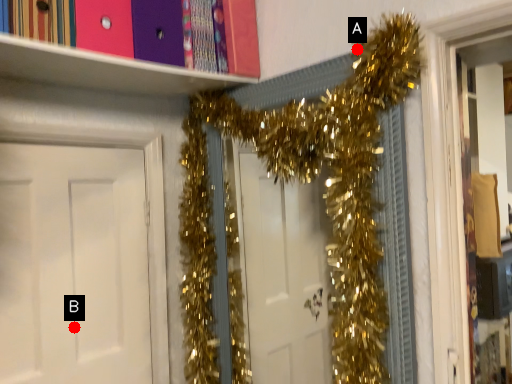
Question: Two points are circled on the image, labeled by A and B beside each circle. Which point is farther to the camera?

Choices:
 (A) A is further
 (B) B is further

Answer: (B)